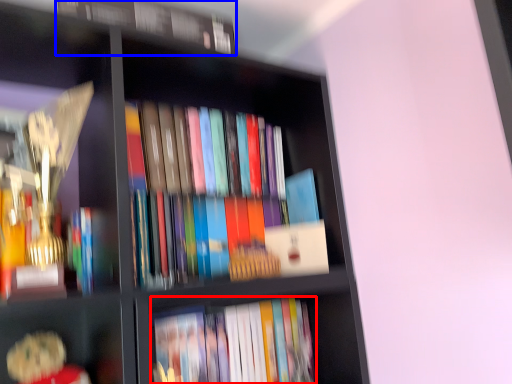
Question: Which object appears farthest to the camera in this image, book (highlighted by a red box) or book (highlighted by a blue box)?

Choices:
 (A) book
 (B) book

Answer: (A)